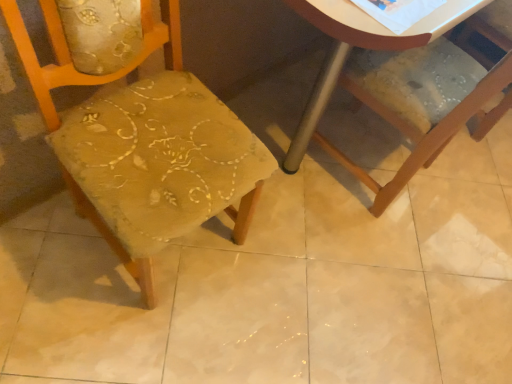
Question: Looking at the image, does wooden chair at lower right, positioned as the 2th chair in left-to-right order, seem bigger or smaller compared to textured fabric chair at center, placed as the second chair when sorted from right to left?

Choices:
 (A) big
 (B) small

Answer: (B)

Question: Is wooden chair at lower right, which is counted as the 1th chair, starting from the right, wider or thinner than textured fabric chair at center, positioned as the first chair in left-to-right order?

Choices:
 (A) wide
 (B) thin

Answer: (A)

Question: From the image's perspective, relative to textured fabric chair at center, positioned as the first chair in left-to-right order, is wooden chair at lower right, which is counted as the 1th chair, starting from the right, above or below?

Choices:
 (A) below
 (B) above

Answer: (B)

Question: In terms of height, does textured fabric chair at center, positioned as the first chair in left-to-right order, look taller or shorter compared to wooden chair at lower right, positioned as the 2th chair in left-to-right order?

Choices:
 (A) tall
 (B) short

Answer: (A)

Question: Is textured fabric chair at center, positioned as the first chair in left-to-right order, wider or thinner than wooden chair at lower right, which is counted as the 1th chair, starting from the right?

Choices:
 (A) thin
 (B) wide

Answer: (A)

Question: Is textured fabric chair at center, placed as the second chair when sorted from right to left, spatially inside wooden chair at lower right, which is counted as the 1th chair, starting from the right, or outside of it?

Choices:
 (A) inside
 (B) outside

Answer: (B)

Question: From a real-world perspective, relative to wooden chair at lower right, which is counted as the 1th chair, starting from the right, is textured fabric chair at center, placed as the second chair when sorted from right to left, vertically above or below?

Choices:
 (A) above
 (B) below

Answer: (A)